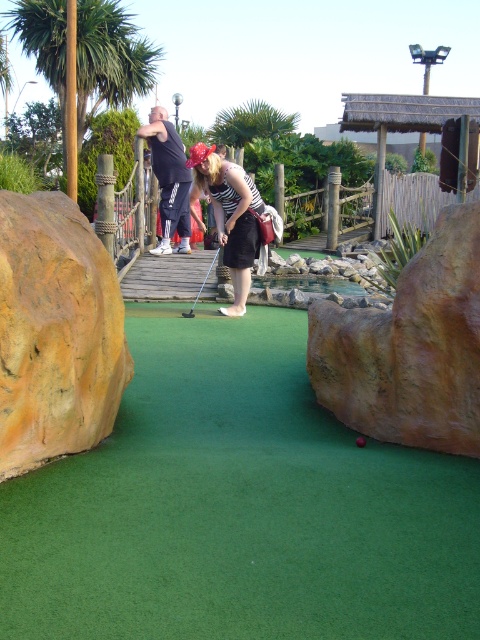
You are playing miniature golf and see the green artificial turf at center and the striped fabric shirt at center in your line of sight. Which object is positioned to the right side from your perspective?

The green artificial turf at center is to the right of the striped fabric shirt at center, so the green artificial turf at center is positioned to the right side from your perspective.

You are playing miniature golf and see the dark blue track pants at center and the metallic silver golf club at center on the bridge. Which object is closer to you?

The dark blue track pants at center is closer to you because the metallic silver golf club at center is behind it.